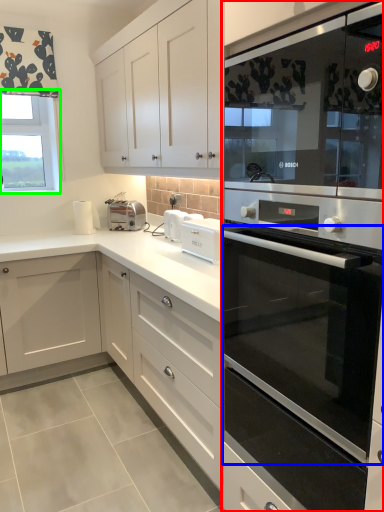
Question: Considering the real-world distances, which object is farthest from home appliance (highlighted by a red box)? oven (highlighted by a blue box) or window (highlighted by a green box)?

Choices:
 (A) oven
 (B) window

Answer: (B)